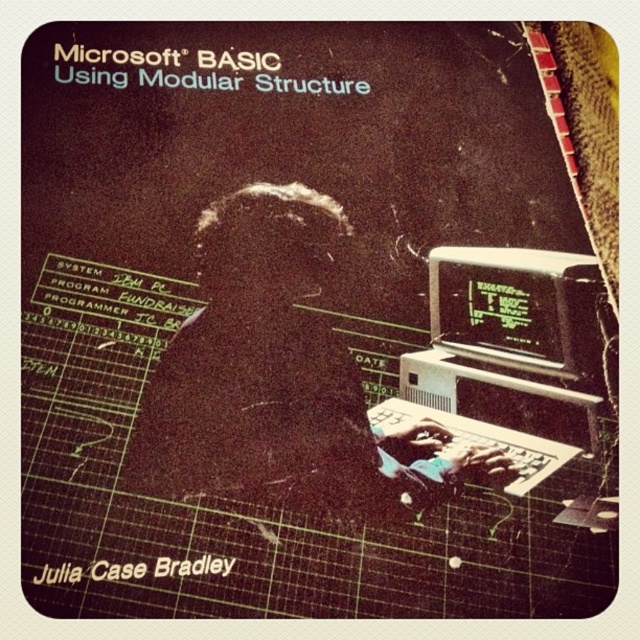
You are a technician who needs to place a 1.5 inch wide cable between the white plastic computer at center and the black plastic monitor at right. Can the cable fit between them?

The distance between the white plastic computer at center and the black plastic monitor at right is 1.00 inches, which is narrower than the 1.5 inch wide cable. The cable cannot fit between them.

You are setting up a desk for a retro computing enthusiast. The enthusiast has a white plastic computer at center and a black plastic monitor at right. Given their sizes, which object should be placed closer to the edge of the desk to save space?

The black plastic monitor at right should be placed closer to the edge of the desk because it is smaller in size than the white plastic computer at center, allowing more space to be saved.